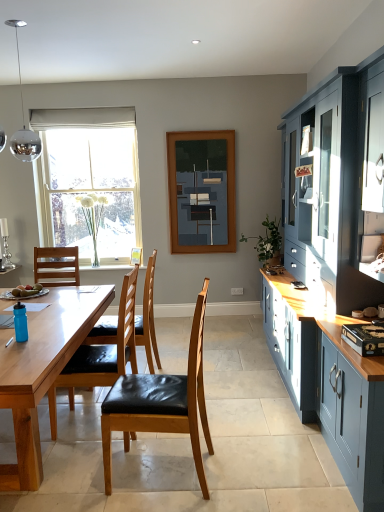
This screenshot has height=512, width=384. Find the location of `free space to the back side of teal matte water bottle at table left`. free space to the back side of teal matte water bottle at table left is located at coordinates (39, 329).